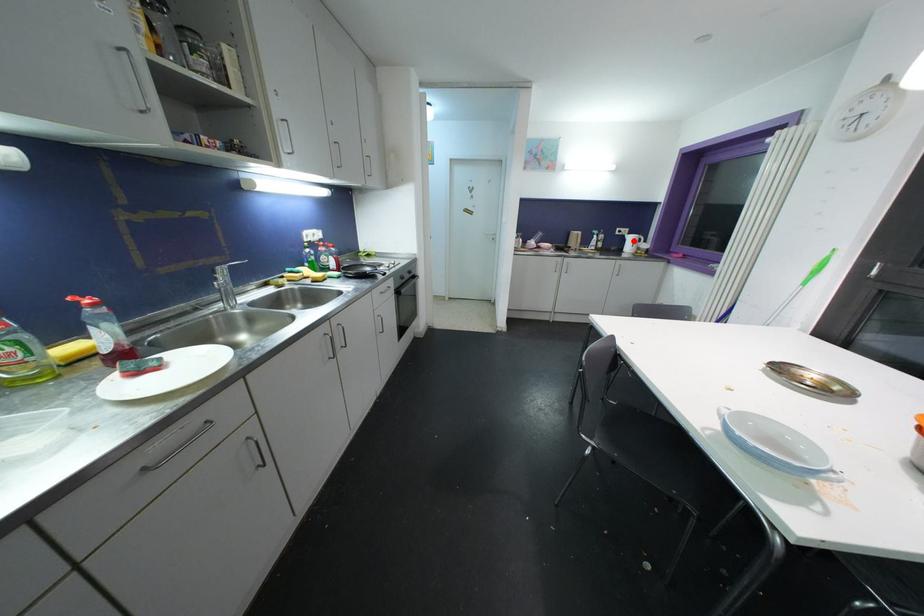
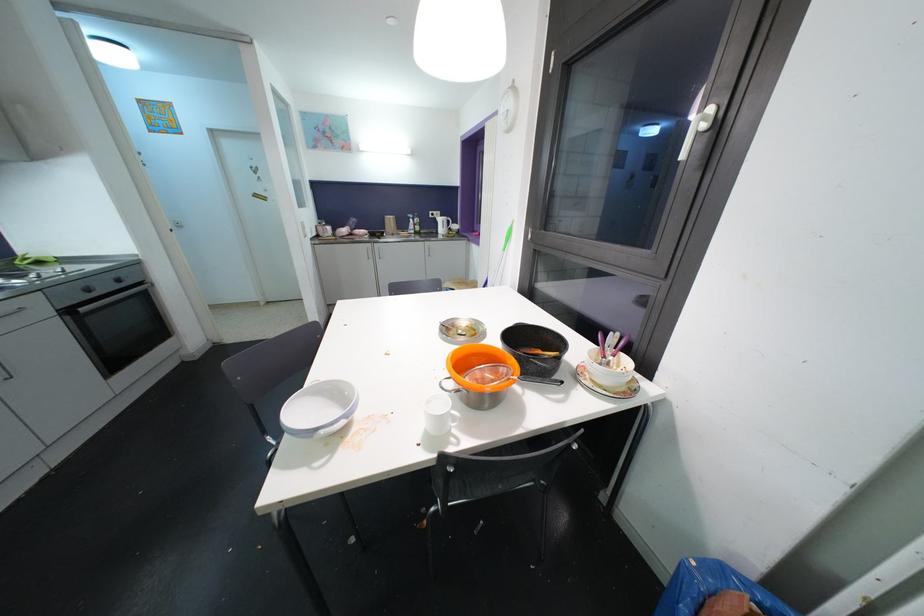
Find the pixel in the second image that matches the highlighted location in the first image.

(444, 223)